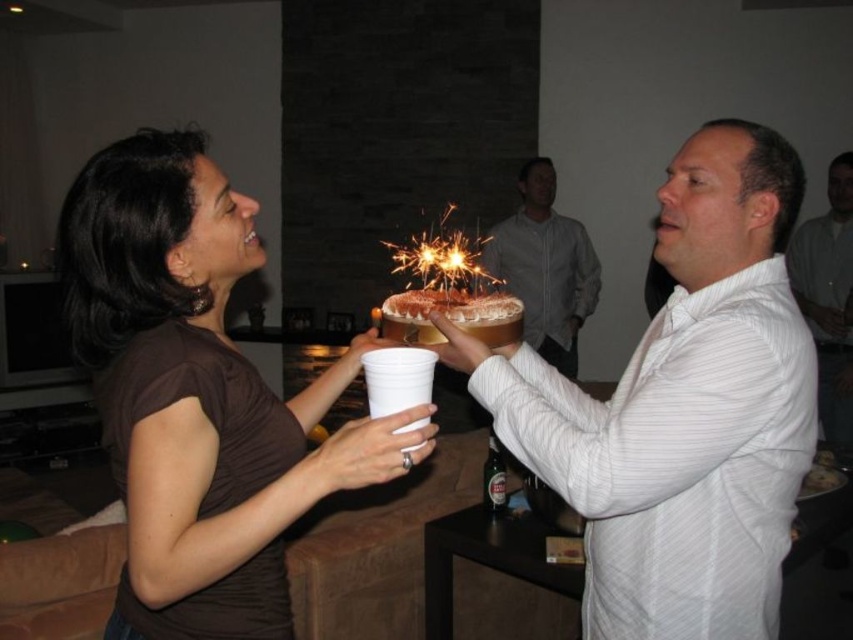
You are at a birthday party and see two cakes at the center of the table. The sparkling golden cake at center and the chocolate frosted cake at center. Which cake is placed higher?

The sparkling golden cake at center is above the chocolate frosted cake at center, so the sparkling golden cake at center is placed higher.